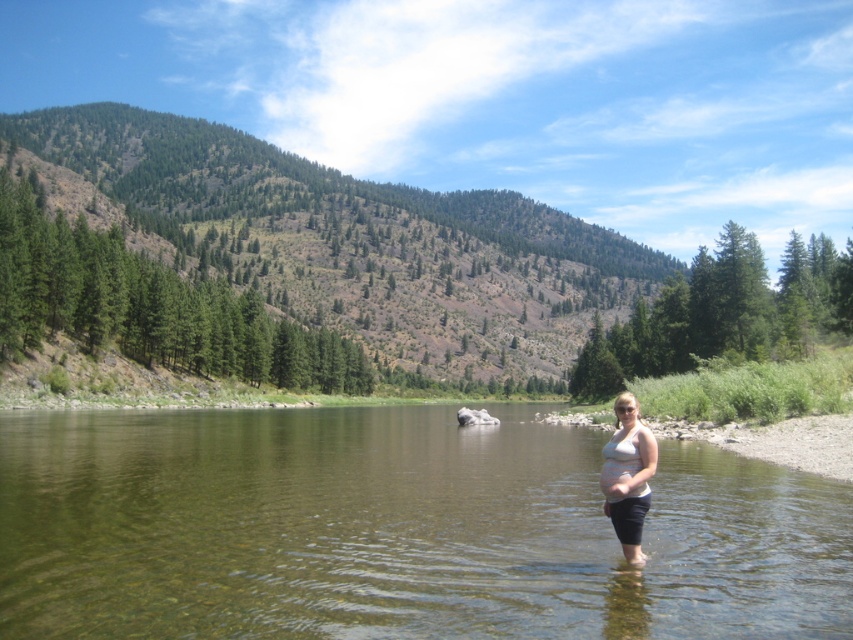
Question: Which object is farther from the camera taking this photo?

Choices:
 (A) white matte tank top at center
 (B) matte skin belly at center

Answer: (B)

Question: In this image, where is clear water at center located relative to matte skin belly at center?

Choices:
 (A) right
 (B) left

Answer: (B)

Question: Which object is the farthest from the clear water at center?

Choices:
 (A) matte skin belly at center
 (B) white matte tank top at center

Answer: (A)

Question: Which point is closer to the camera taking this photo?

Choices:
 (A) (627, 476)
 (B) (613, 522)
 (C) (558, 515)

Answer: (B)

Question: Does clear water at center have a lesser width compared to matte skin belly at center?

Choices:
 (A) no
 (B) yes

Answer: (A)

Question: From the image, what is the correct spatial relationship of clear water at center in relation to matte skin belly at center?

Choices:
 (A) above
 (B) below

Answer: (B)